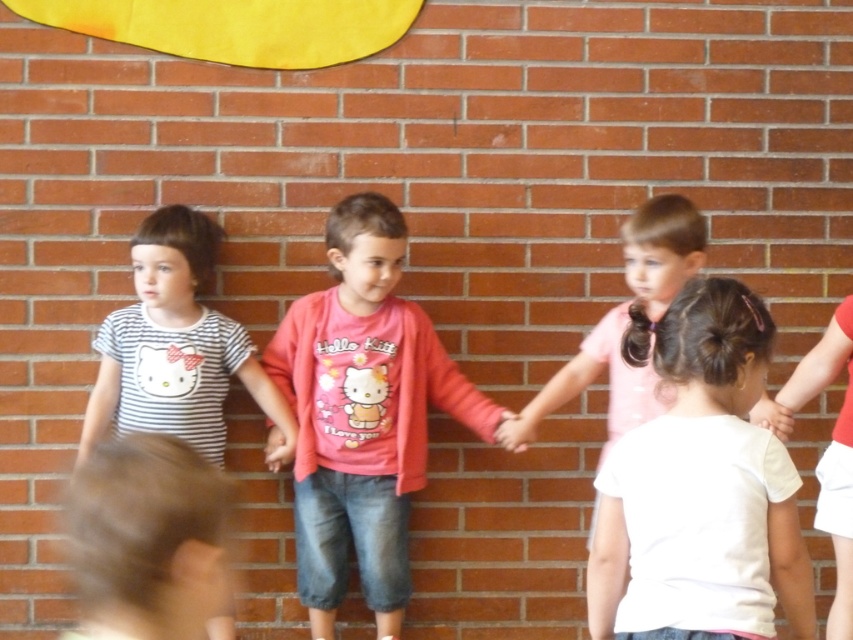
Who is more distant from viewer, (624, 532) or (160, 230)?

Positioned behind is point (160, 230).

Between white matte shirt at center and striped cotton shirt at left, which one is positioned lower?

white matte shirt at center is lower down.

At what (x,y) coordinates should I click in order to perform the action: click on white matte shirt at center. Please return your answer as a coordinate pair (x, y). The width and height of the screenshot is (853, 640). Looking at the image, I should click on (701, 490).

Does pink cotton shirt at center have a larger size compared to white matte hand at lower right?

Yes, pink cotton shirt at center is bigger than white matte hand at lower right.

Find the location of `pink cotton shirt at center`. pink cotton shirt at center is located at coordinates (363, 413).

Between point (415, 364) and point (761, 397), which one is positioned behind?

Positioned behind is point (415, 364).

The width and height of the screenshot is (853, 640). I want to click on pink cotton shirt at center, so click(x=363, y=413).

Is point (384, 436) farther from camera compared to point (270, 461)?

No.

Who is more forward, (368,202) or (268,440)?

Point (368,202)

Is point (338, 481) less distant than point (271, 442)?

That is True.

I want to click on pink cotton shirt at center, so click(363, 413).